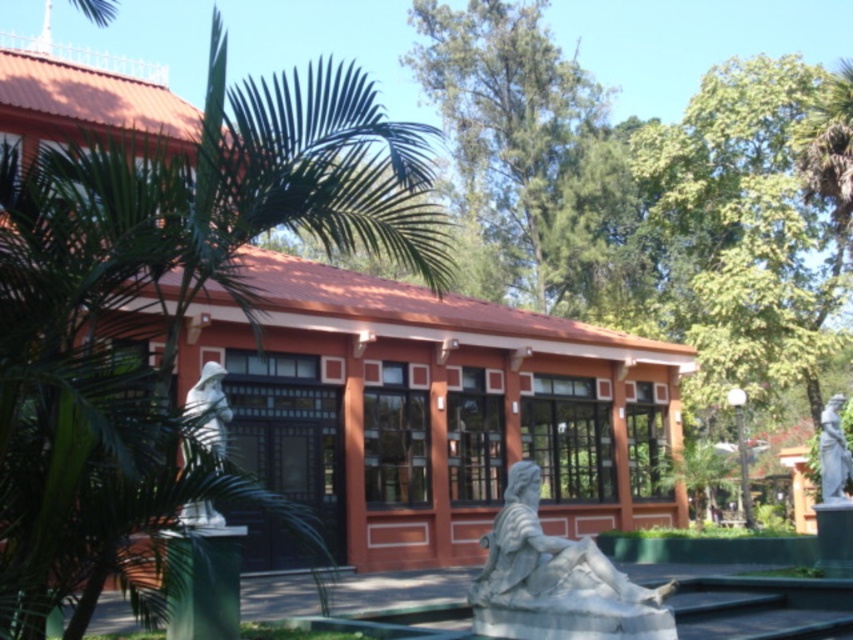
Question: Does green leafy palm tree at left have a larger size compared to gray stone statue at lower center?

Choices:
 (A) no
 (B) yes

Answer: (B)

Question: Which point is closer to the camera taking this photo?

Choices:
 (A) (223, 538)
 (B) (834, 474)
 (C) (345, 152)

Answer: (C)

Question: Does green leafy palm tree at left have a larger size compared to gray stone statue at lower center?

Choices:
 (A) no
 (B) yes

Answer: (B)

Question: Considering the relative positions of green leafy tree at upper center and white marble statue at right in the image provided, where is green leafy tree at upper center located with respect to white marble statue at right?

Choices:
 (A) right
 (B) left

Answer: (B)

Question: Which object appears closest to the camera in this image?

Choices:
 (A) green leafy palm tree at left
 (B) white marble statue at right

Answer: (A)

Question: Considering the real-world distances, which object is closest to the green leafy palm tree at left?

Choices:
 (A) green leafy tree at upper center
 (B) white marble statue at right
 (C) gray stone statue at lower center

Answer: (C)